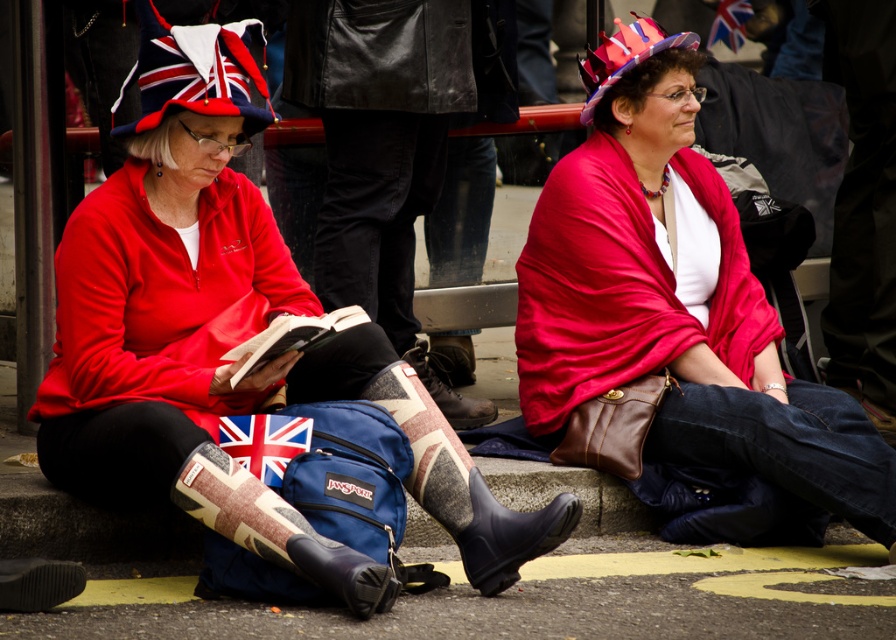
Who is taller, matte red scarf at center or camouflage-patterned rubber boot at center?

Standing taller between the two is matte red scarf at center.

Can you confirm if matte red scarf at center is smaller than camouflage-patterned rubber boot at center?

No.

Measure the distance between matte red scarf at center and camera.

The distance of matte red scarf at center from camera is 6.96 meters.

Where is `matte red scarf at center`? Image resolution: width=896 pixels, height=640 pixels. matte red scarf at center is located at coordinates (675, 298).

Between camouflage-patterned rubber boot at center and union jack flag at upper center, which one appears on the right side from the viewer's perspective?

union jack flag at upper center

Which of these two, camouflage-patterned rubber boot at center or union jack flag at upper center, stands shorter?

union jack flag at upper center

Who is more forward, (368, 560) or (737, 12)?

Point (368, 560) is in front.

I want to click on camouflage-patterned rubber boot at center, so click(277, 531).

Is point (286, 428) behind point (734, 17)?

No, (286, 428) is in front of (734, 17).

Can you confirm if union jack fabric at center is taller than union jack flag at upper center?

No.

Which is behind, point (299, 420) or point (737, 32)?

Point (737, 32)

This screenshot has height=640, width=896. Identify the location of union jack fabric at center. (264, 442).